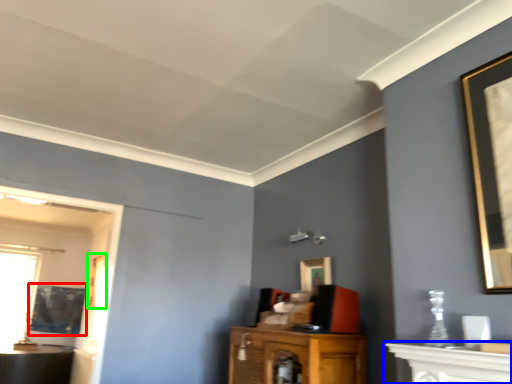
Question: Considering the real-world distances, which object is closest to picture frame (highlighted by a red box)? vanity (highlighted by a blue box) or picture frame (highlighted by a green box).

Choices:
 (A) vanity
 (B) picture frame

Answer: (B)